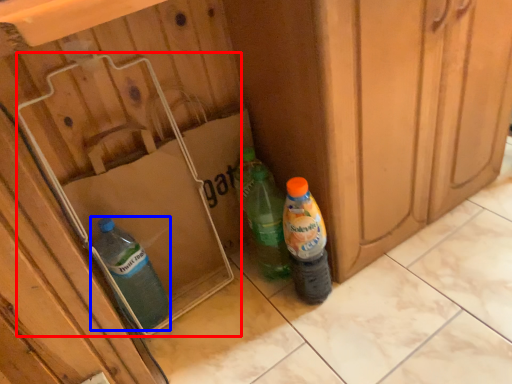
Question: Which object appears farthest to the camera in this image, cardboard box (highlighted by a red box) or bottle (highlighted by a blue box)?

Choices:
 (A) cardboard box
 (B) bottle

Answer: (B)